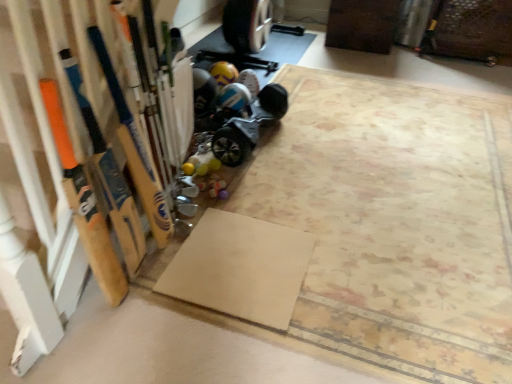
You are a GUI agent. You are given a task and a screenshot of the screen. Output one action in this format:
    pyautogui.click(x=<x>, y=<y>)
    Task: Click on the vacant space in between wooden baseball bat at left, which is the first baseball bat from right to left, and beige matte yoga mat at lower center
    
    Given the screenshot: What is the action you would take?
    pyautogui.click(x=164, y=252)